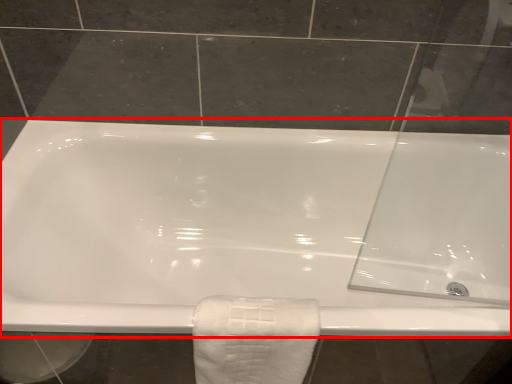
Question: From the image's perspective, considering the relative positions of bathtub (annotated by the red box) and towel in the image provided, where is bathtub (annotated by the red box) located with respect to the staircase?

Choices:
 (A) above
 (B) below

Answer: (A)